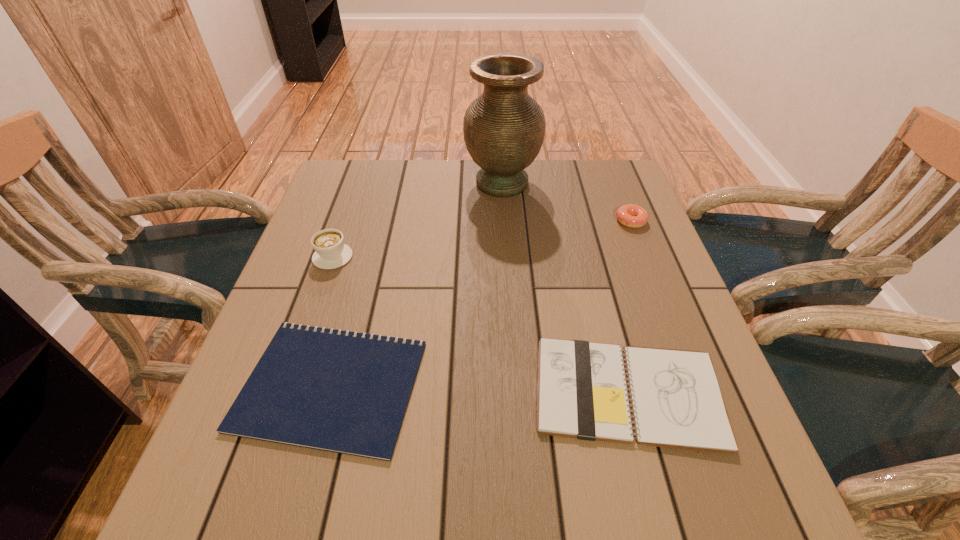
Locate an element on the screen. The width and height of the screenshot is (960, 540). doughnut that is positioned at the right edge is located at coordinates (633, 216).

The height and width of the screenshot is (540, 960). I want to click on notepad that is at the right edge, so click(676, 402).

Locate an element on the screen. free location at the far edge is located at coordinates (464, 188).

Locate an element on the screen. The width and height of the screenshot is (960, 540). free region at the near edge of the desktop is located at coordinates (630, 476).

Where is `free region at the left edge of the desktop`? The width and height of the screenshot is (960, 540). free region at the left edge of the desktop is located at coordinates (278, 296).

This screenshot has height=540, width=960. Find the location of `vacant region at the right edge`. vacant region at the right edge is located at coordinates 638,293.

The height and width of the screenshot is (540, 960). Find the location of `vacant area at the far left corner of the desktop`. vacant area at the far left corner of the desktop is located at coordinates (372, 191).

Identify the location of free spot at the near left corner of the desktop. Image resolution: width=960 pixels, height=540 pixels. (291, 499).

Identify the location of free space at the far right corner. (627, 172).

The image size is (960, 540). In the image, there is a desktop. Identify the location of free space at the near right corner. (668, 515).